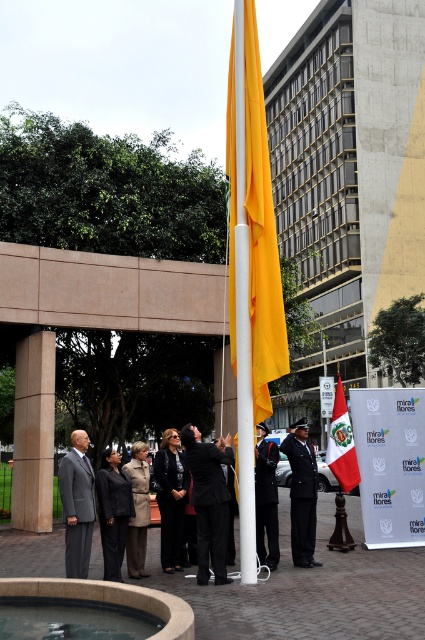
You are attending a formal event and see the black glossy suit at center and the peruvian flag at center. Which object is closer to the ground?

The black glossy suit at center is closer to the ground because it is positioned under the peruvian flag at center.

You are attending the event and see the black glossy suit at center and the peruvian flag at center. Which object is positioned to the left of the other?

Result: The black glossy suit at center is to the left of the peruvian flag at center.